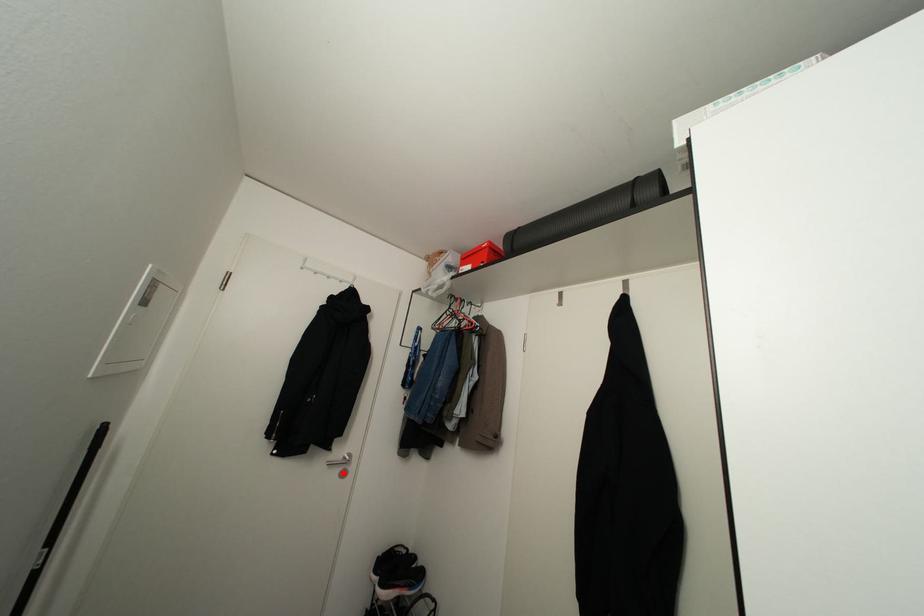
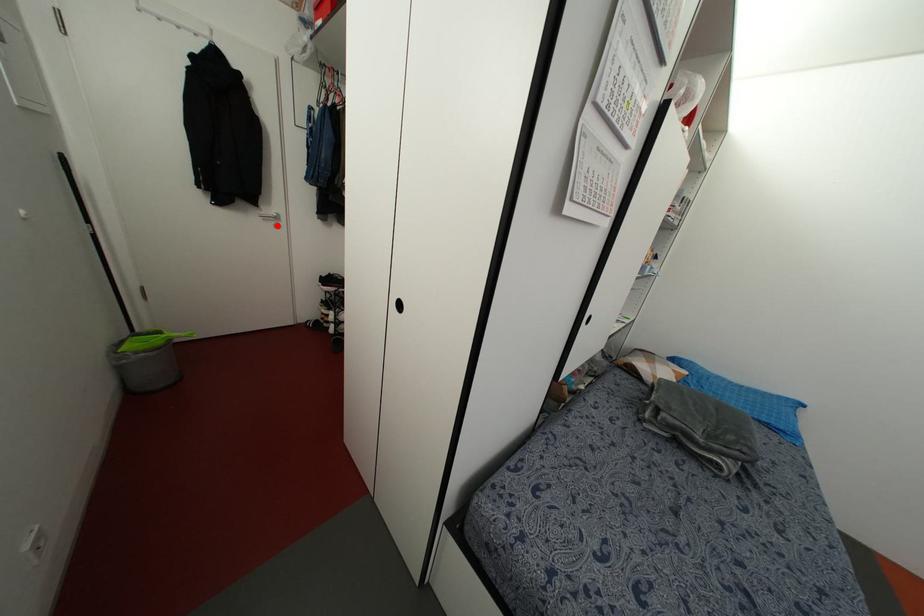
I am providing you with two images of the same scene from different viewpoints. A red point is marked on the first image and another point is marked on the second image. Does the point marked in image1 correspond to the same location as the one in image2?

Yes